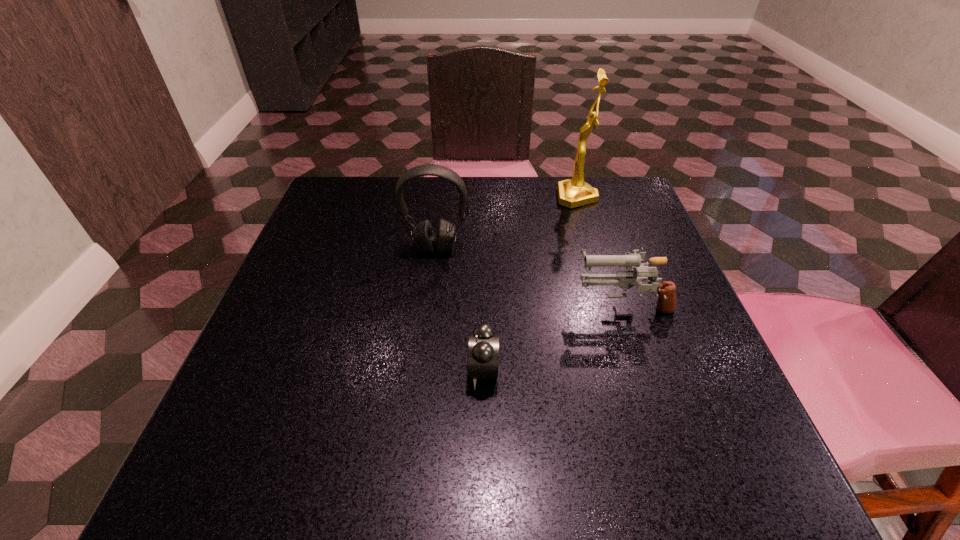
You are a GUI agent. You are given a task and a screenshot of the screen. Output one action in this format:
    pyautogui.click(x=<x>, y=<y>)
    Task: Click on the award
    Image resolution: width=960 pixels, height=540 pixels.
    Given the screenshot: What is the action you would take?
    (x=572, y=193)

Identify the location of the farthest object. (572, 193).

Where is `the third shortest object`? The height and width of the screenshot is (540, 960). the third shortest object is located at coordinates (423, 236).

Find the location of a particular element. This screenshot has height=540, width=960. the leftmost object is located at coordinates (423, 236).

Locate an element on the screen. The width and height of the screenshot is (960, 540). the second nearest object is located at coordinates (625, 279).

Find the location of a particular element. This screenshot has height=540, width=960. gun is located at coordinates (625, 279).

Identify the location of the shortest object. This screenshot has height=540, width=960. (483, 343).

At what (x,y) coordinates should I click in order to perform the action: click on the nearest object. Please return your answer as a coordinate pair (x, y). This screenshot has height=540, width=960. Looking at the image, I should click on (483, 343).

This screenshot has width=960, height=540. Find the location of `free space located on the front-facing side of the farthest object`. free space located on the front-facing side of the farthest object is located at coordinates (x=429, y=197).

Image resolution: width=960 pixels, height=540 pixels. Find the location of `free space located 0.370m on the front-facing side of the farthest object`. free space located 0.370m on the front-facing side of the farthest object is located at coordinates (414, 197).